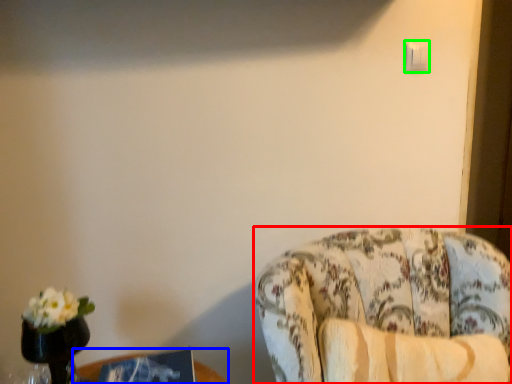
Question: Which object is positioned farthest from chair (highlighted by a red box)? Select from table (highlighted by a blue box) and light switch (highlighted by a green box).

Choices:
 (A) table
 (B) light switch

Answer: (B)